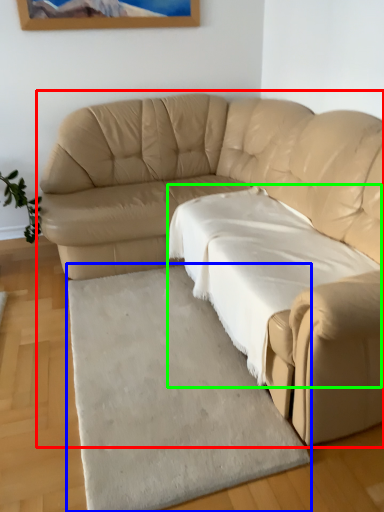
Question: Considering the real-world distances, which object is closest to studio couch (highlighted by a red box)? mat (highlighted by a blue box) or sheet (highlighted by a green box).

Choices:
 (A) mat
 (B) sheet

Answer: (B)